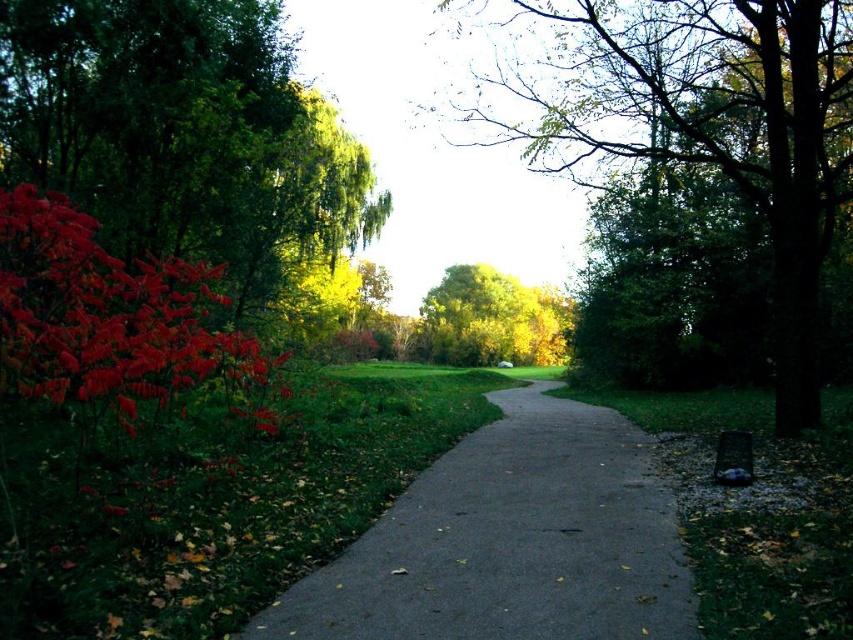
You are standing in the park and want to take a photo of the green leafy tree at center. If your camera can focus on objects up to 5 meters away, will you need to move closer or farther away to capture the tree clearly?

The green leafy tree at center is 5.34 meters away from you. Since your camera can focus up to 5 meters, you need to move closer to the green leafy tree at center to ensure it is within the camera range.

You are standing at the point marked by the coordinates point [688,122] in the park. Looking around, you see a green leafy tree at center. Which direction should you walk to reach the green leafy tree at center?

Since the point [688,122] marks the green leafy tree at center, you are already at the location of the green leafy tree at center.